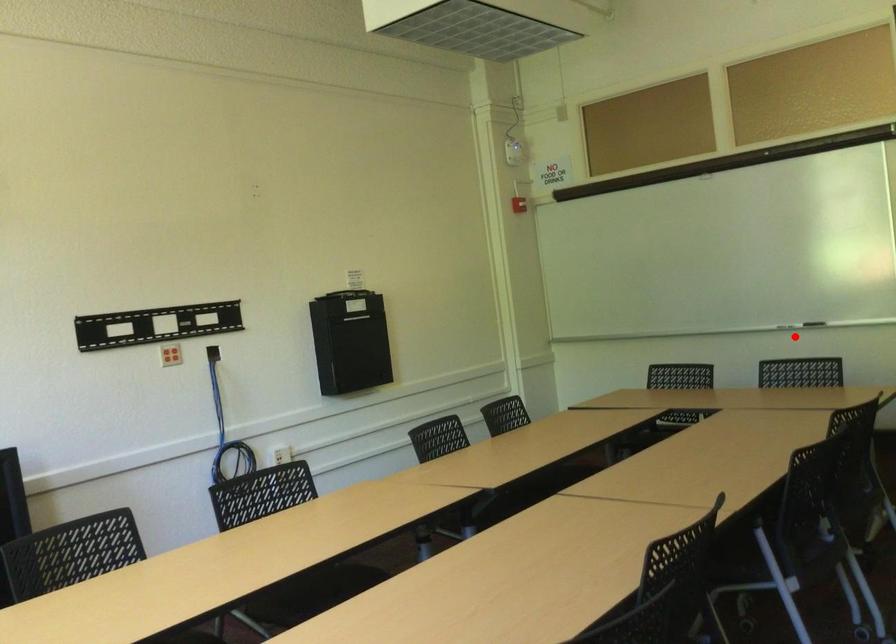
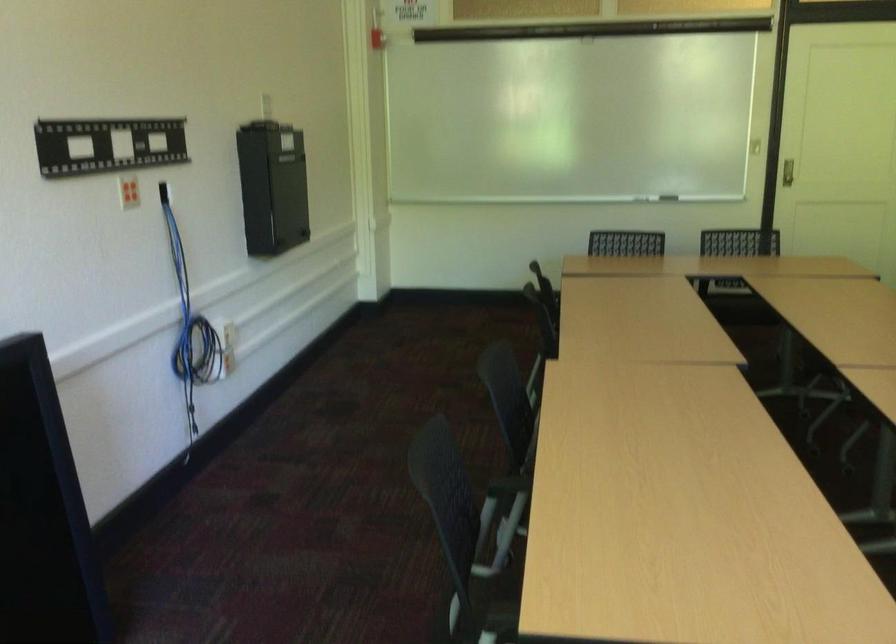
Find the pixel in the second image that matches the highlighted location in the first image.

(668, 198)